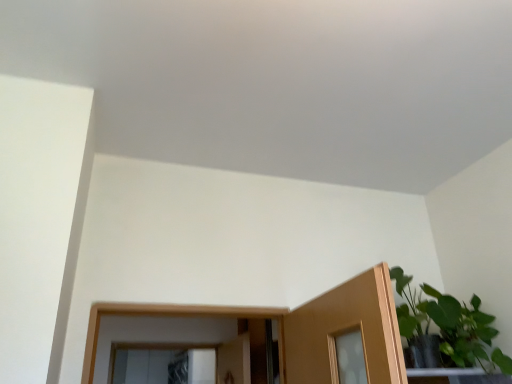
What do you see at coordinates (450, 325) in the screenshot? The height and width of the screenshot is (384, 512). I see `green leafy plant at upper right` at bounding box center [450, 325].

Measure the distance between green leafy plant at upper right and camera.

1.72 meters.

This screenshot has width=512, height=384. I want to click on green leafy plant at upper right, so click(x=450, y=325).

Locate an element on the screen. green leafy plant at upper right is located at coordinates (450, 325).